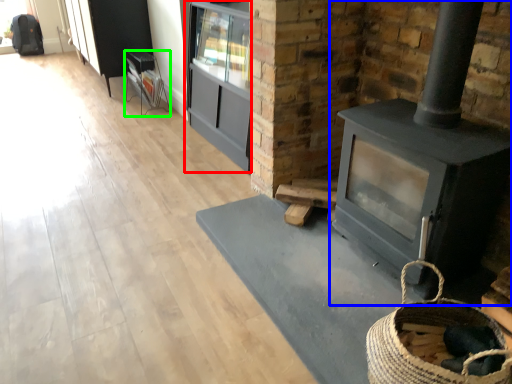
Question: Considering the real-world distances, which object is farthest from entertainment center (highlighted by a red box)? wood burning stove (highlighted by a blue box) or furniture (highlighted by a green box)?

Choices:
 (A) wood burning stove
 (B) furniture

Answer: (A)